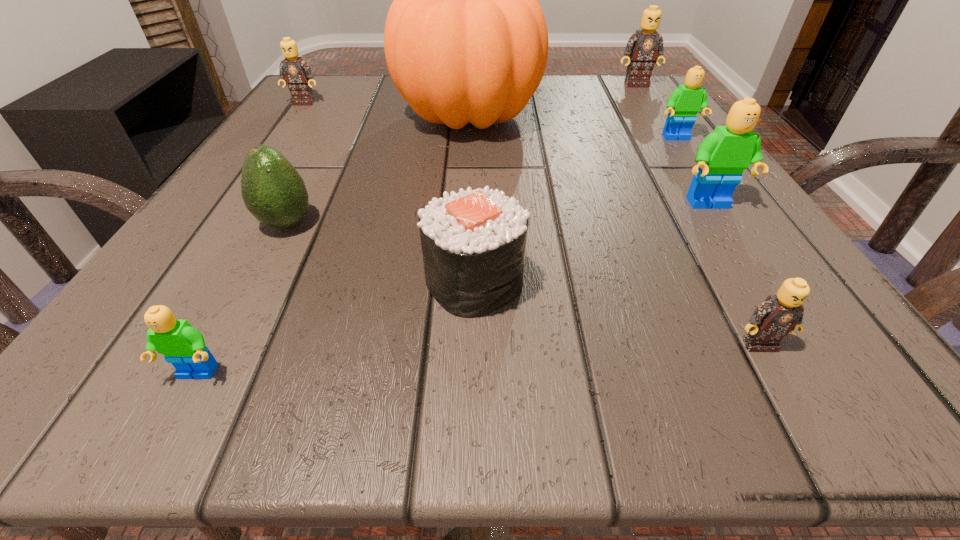
The image size is (960, 540). Find the location of `vacant space at the near edge`. vacant space at the near edge is located at coordinates (594, 382).

Identify the location of free space at the right edge. The image size is (960, 540). (684, 149).

The image size is (960, 540). Find the location of `vacant point at the far left corner`. vacant point at the far left corner is located at coordinates (333, 77).

Locate an element on the screen. This screenshot has width=960, height=540. free region at the far right corner of the desktop is located at coordinates pos(613,120).

You are a GUI agent. You are given a task and a screenshot of the screen. Output one action in this format:
    pyautogui.click(x=<x>, y=<y>)
    Task: Click on the free spot between the pumpkin and the third farthest Lego
    
    Given the screenshot: What is the action you would take?
    pyautogui.click(x=572, y=127)

At what (x,y) coordinates should I click in order to perform the action: click on free space between the second nearest object and the farthest Lego. Please return your answer as a coordinate pair (x, y). Looking at the image, I should click on (697, 214).

This screenshot has height=540, width=960. What are the coordinates of `vacant area that lies between the fifth farthest Lego and the biggest green Lego` in the screenshot? It's located at (733, 274).

Find the location of a particular element. free space that is in between the nearest green Lego and the sushi is located at coordinates tap(336, 328).

This screenshot has height=540, width=960. What are the coordinates of `blank region between the green avocado and the farthest Lego` in the screenshot? It's located at (461, 154).

The height and width of the screenshot is (540, 960). I want to click on unoccupied area between the green avocado and the farthest Lego, so click(x=461, y=154).